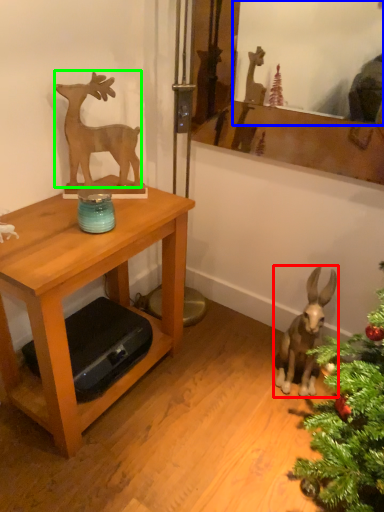
Question: Which is farther away from animal (highlighted by a red box)? mirror (highlighted by a blue box) or deer (highlighted by a green box)?

Choices:
 (A) mirror
 (B) deer

Answer: (A)